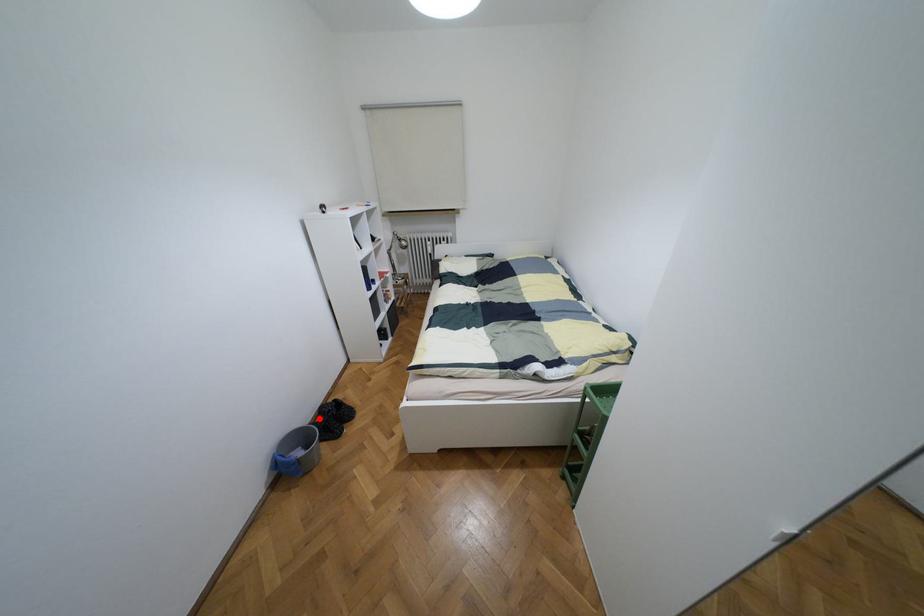
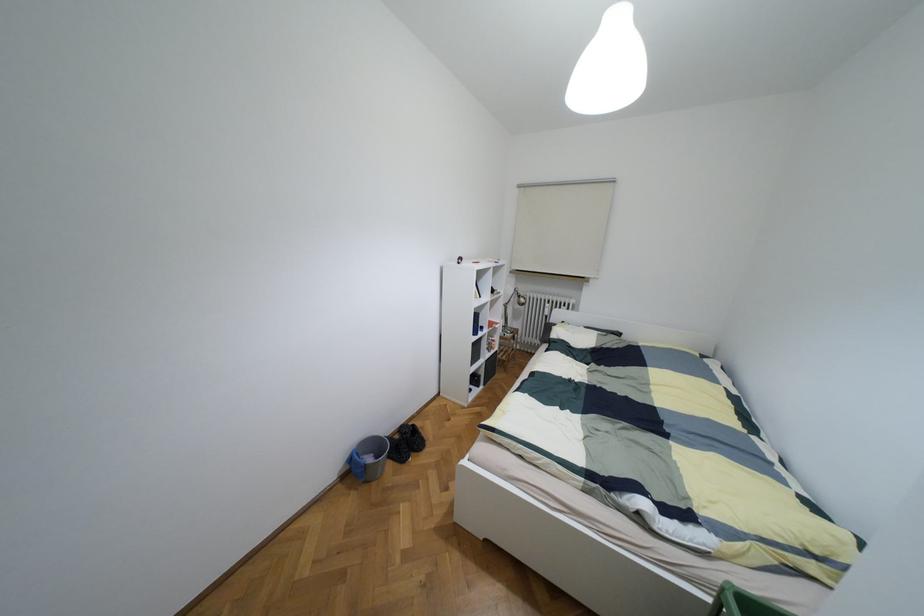
In the second image, find the point that corresponds to the highlighted location in the first image.

(395, 436)